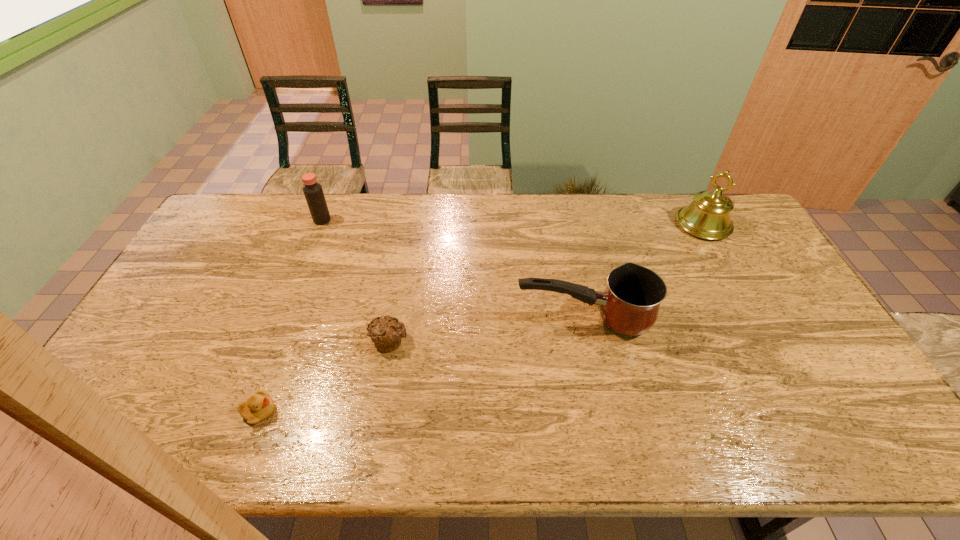
At what (x,y) coordinates should I click in order to perform the action: click on vacant space located 0.070m on the handle side of the saucepan. Please return your answer as a coordinate pair (x, y). The height and width of the screenshot is (540, 960). Looking at the image, I should click on (491, 319).

At what (x,y) coordinates should I click in order to perform the action: click on vacant area situated on the left of the third object from right to left. Please return your answer as a coordinate pair (x, y). Looking at the image, I should click on (247, 340).

Where is `vacant position located at the beak of the duckling`? The width and height of the screenshot is (960, 540). vacant position located at the beak of the duckling is located at coordinates (420, 411).

Identify the location of bell located at the far edge. (708, 216).

Identify the location of vinegar located in the far edge section of the desktop. The height and width of the screenshot is (540, 960). (313, 192).

This screenshot has width=960, height=540. I want to click on object present at the near edge, so click(258, 407).

Locate an element on the screen. This screenshot has height=540, width=960. object at the right edge is located at coordinates (708, 216).

Identify the location of object that is positioned at the far right corner. This screenshot has height=540, width=960. (708, 216).

The height and width of the screenshot is (540, 960). In the image, there is a desktop. What are the coordinates of `vacant region at the far edge` in the screenshot? It's located at (537, 224).

The width and height of the screenshot is (960, 540). In order to click on free region at the near edge of the desktop in this screenshot , I will do `click(317, 439)`.